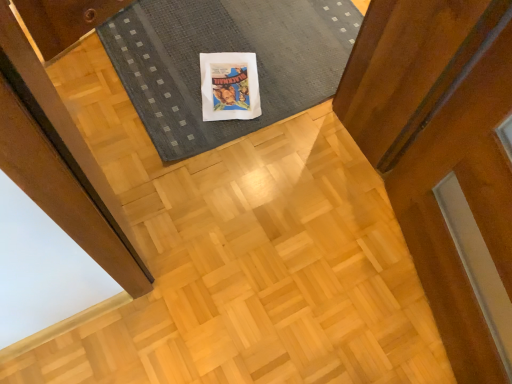
Question: Based on their positions, is matte white comic book at center located to the left or right of dark gray textured mat at center?

Choices:
 (A) right
 (B) left

Answer: (B)

Question: Is point (204, 102) closer or farther from the camera than point (276, 29)?

Choices:
 (A) closer
 (B) farther

Answer: (A)

Question: Is matte white comic book at center in front of or behind dark gray textured mat at center in the image?

Choices:
 (A) front
 (B) behind

Answer: (B)

Question: In the image, is dark gray textured mat at center positioned in front of or behind matte white comic book at center?

Choices:
 (A) behind
 (B) front

Answer: (B)

Question: Which is correct: dark gray textured mat at center is inside matte white comic book at center, or outside of it?

Choices:
 (A) inside
 (B) outside

Answer: (B)

Question: Considering the relative positions of dark gray textured mat at center and matte white comic book at center in the image provided, is dark gray textured mat at center to the left or to the right of matte white comic book at center?

Choices:
 (A) right
 (B) left

Answer: (A)

Question: From a real-world perspective, is dark gray textured mat at center positioned above or below matte white comic book at center?

Choices:
 (A) above
 (B) below

Answer: (A)